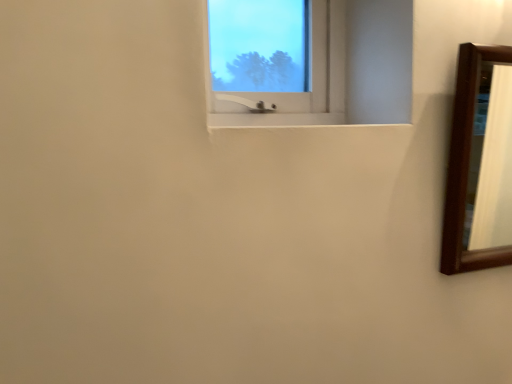
Find the location of `transparent glass window at upper center`. transparent glass window at upper center is located at coordinates (259, 45).

What do you see at coordinates (259, 45) in the screenshot?
I see `transparent glass window at upper center` at bounding box center [259, 45].

The image size is (512, 384). Describe the element at coordinates (490, 163) in the screenshot. I see `brown wooden mirror at right` at that location.

Find the location of a particular element. brown wooden mirror at right is located at coordinates (490, 163).

This screenshot has width=512, height=384. I want to click on transparent glass window at upper center, so pyautogui.click(x=259, y=45).

Which object is positioned more to the right, transparent glass window at upper center or brown wooden mirror at right?

brown wooden mirror at right.

Is transparent glass window at upper center positioned before brown wooden mirror at right?

That is True.

Considering the points (269, 53) and (479, 109), which point is behind, point (269, 53) or point (479, 109)?

The point (479, 109) is more distant.

From the image's perspective, is transparent glass window at upper center beneath brown wooden mirror at right?

No, from the image's perspective, transparent glass window at upper center is not below brown wooden mirror at right.

From a real-world perspective, relative to brown wooden mirror at right, is transparent glass window at upper center vertically above or below?

From a real-world perspective, transparent glass window at upper center is physically above brown wooden mirror at right.

Considering the relative sizes of transparent glass window at upper center and brown wooden mirror at right in the image provided, is transparent glass window at upper center wider than brown wooden mirror at right?

Incorrect, the width of transparent glass window at upper center does not surpass that of brown wooden mirror at right.

Is transparent glass window at upper center taller or shorter than brown wooden mirror at right?

Clearly, transparent glass window at upper center is shorter compared to brown wooden mirror at right.

Can you confirm if transparent glass window at upper center is smaller than brown wooden mirror at right?

Yes.

Does transparent glass window at upper center contain brown wooden mirror at right?

No, brown wooden mirror at right is not surrounded by transparent glass window at upper center.

Would you consider transparent glass window at upper center to be distant from brown wooden mirror at right?

No, transparent glass window at upper center is not far away from brown wooden mirror at right.

Is brown wooden mirror at right at the back of transparent glass window at upper center?

transparent glass window at upper center does not have its back to brown wooden mirror at right.

How different are the orientations of transparent glass window at upper center and brown wooden mirror at right in degrees?

0.0993 degrees separate the facing orientations of transparent glass window at upper center and brown wooden mirror at right.

Measure the distance between transparent glass window at upper center and brown wooden mirror at right.

transparent glass window at upper center is 32.34 inches away from brown wooden mirror at right.

The height and width of the screenshot is (384, 512). Find the location of `window screen that is in front of the brown wooden mirror at right`. window screen that is in front of the brown wooden mirror at right is located at coordinates point(259,45).

Is brown wooden mirror at right to the left of transparent glass window at upper center from the viewer's perspective?

No.

Between brown wooden mirror at right and transparent glass window at upper center, which one is positioned in front?

transparent glass window at upper center is in front.

Considering the points (504, 211) and (292, 42), which point is behind, point (504, 211) or point (292, 42)?

The point (504, 211) is farther from the camera.

From the image's perspective, would you say brown wooden mirror at right is shown under transparent glass window at upper center?

Yes, from the image's perspective, brown wooden mirror at right is below transparent glass window at upper center.

From a real-world perspective, is brown wooden mirror at right located beneath transparent glass window at upper center?

Yes, from a real-world perspective, brown wooden mirror at right is beneath transparent glass window at upper center.

Does brown wooden mirror at right have a greater width compared to transparent glass window at upper center?

Yes, brown wooden mirror at right is wider than transparent glass window at upper center.

Can you confirm if brown wooden mirror at right is taller than transparent glass window at upper center?

Correct, brown wooden mirror at right is much taller as transparent glass window at upper center.

Between brown wooden mirror at right and transparent glass window at upper center, which one has larger size?

brown wooden mirror at right.

Is brown wooden mirror at right inside the boundaries of transparent glass window at upper center, or outside?

brown wooden mirror at right cannot be found inside transparent glass window at upper center.

Consider the image. Is brown wooden mirror at right not close to transparent glass window at upper center?

They are positioned close to each other.

Is brown wooden mirror at right looking in the opposite direction of transparent glass window at upper center?

No, brown wooden mirror at right's orientation is not away from transparent glass window at upper center.

How different are the orientations of brown wooden mirror at right and transparent glass window at upper center in degrees?

The facing directions of brown wooden mirror at right and transparent glass window at upper center are 0.0993 degrees apart.

Identify the location of window screen in front of the brown wooden mirror at right. The height and width of the screenshot is (384, 512). (259, 45).

Where is `window screen located on the left of brown wooden mirror at right`? window screen located on the left of brown wooden mirror at right is located at coordinates point(259,45).

This screenshot has width=512, height=384. Find the location of `window screen in front of the brown wooden mirror at right`. window screen in front of the brown wooden mirror at right is located at coordinates (259, 45).